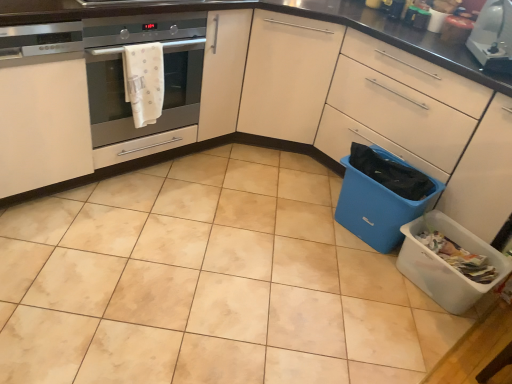
Question: Is blue plastic bin at lower right, which is the 2th material in top-to-bottom order, positioned with its back to matte white cabinet at center, which is the 2th cabinetry from left to right?

Choices:
 (A) yes
 (B) no

Answer: (A)

Question: Can you confirm if blue plastic bin at lower right, the 2th material viewed from the left, is bigger than matte white cabinet at center, the 1th cabinetry viewed from the right?

Choices:
 (A) no
 (B) yes

Answer: (A)

Question: Is blue plastic bin at lower right, the 2th material viewed from the left, far from matte white cabinet at center, which is the 2th cabinetry from left to right?

Choices:
 (A) yes
 (B) no

Answer: (B)

Question: Is blue plastic bin at lower right, the first material when ordered from bottom to top, not inside matte white cabinet at center, the 1th cabinetry viewed from the right?

Choices:
 (A) no
 (B) yes

Answer: (A)

Question: Can you confirm if blue plastic bin at lower right, the first material when ordered from bottom to top, is thinner than matte white cabinet at center, which is the 2th cabinetry from left to right?

Choices:
 (A) no
 (B) yes

Answer: (B)

Question: Can you confirm if blue plastic bin at lower right, which is the 2th material in top-to-bottom order, is taller than matte white cabinet at center, which is the 2th cabinetry from left to right?

Choices:
 (A) yes
 (B) no

Answer: (B)

Question: From the image's perspective, is matte white cabinet at center, which is the 2th cabinetry from left to right, over satin silver oven at left?

Choices:
 (A) no
 (B) yes

Answer: (A)

Question: Considering the relative positions of matte white cabinet at center, which is the 2th cabinetry from left to right, and satin silver oven at left in the image provided, is matte white cabinet at center, which is the 2th cabinetry from left to right, in front of satin silver oven at left?

Choices:
 (A) yes
 (B) no

Answer: (A)

Question: Is matte white cabinet at center, which is the 2th cabinetry from left to right, positioned far away from satin silver oven at left?

Choices:
 (A) yes
 (B) no

Answer: (B)

Question: Can you confirm if matte white cabinet at center, the 1th cabinetry viewed from the right, is positioned to the right of satin silver oven at left?

Choices:
 (A) no
 (B) yes

Answer: (B)

Question: From a real-world perspective, does matte white cabinet at center, which is the 2th cabinetry from left to right, stand above satin silver oven at left?

Choices:
 (A) yes
 (B) no

Answer: (B)

Question: Considering the relative sizes of matte white cabinet at center, which is the 2th cabinetry from left to right, and satin silver oven at left in the image provided, is matte white cabinet at center, which is the 2th cabinetry from left to right, taller than satin silver oven at left?

Choices:
 (A) yes
 (B) no

Answer: (A)

Question: Is white glossy toaster at upper right surrounding satin silver oven at left?

Choices:
 (A) yes
 (B) no

Answer: (B)